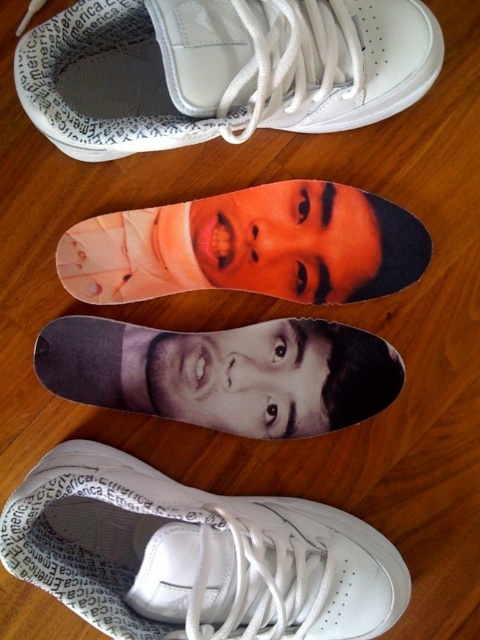
Where is the white leather shoe at lower center located in the image?

The white leather shoe at lower center is located at point (194, 556).

You are trying to decide which insole to choose for your new sneakers. The matte orange face at center and the black matte selfie at center are both options. Based on their sizes, which one do you think would be better for a design that requires more visual impact?

The matte orange face at center is much taller as black matte selfie at center, so it would provide a more visually impactful design due to its larger size.

You are a photographer trying to capture both the black matte selfie at center and the gray matte face at center in a single shot. The camera you are using has a minimum focus distance of 2.5 centimeters. Will you be able to focus on both subjects simultaneously?

The black matte selfie at center is 2.28 centimeters from the gray matte face at center. Since the distance between them is less than the camera minimum focus distance of 2.5 centimeters, the camera cannot focus on both subjects simultaneously. You will need to move closer to ensure both are within the focus range.